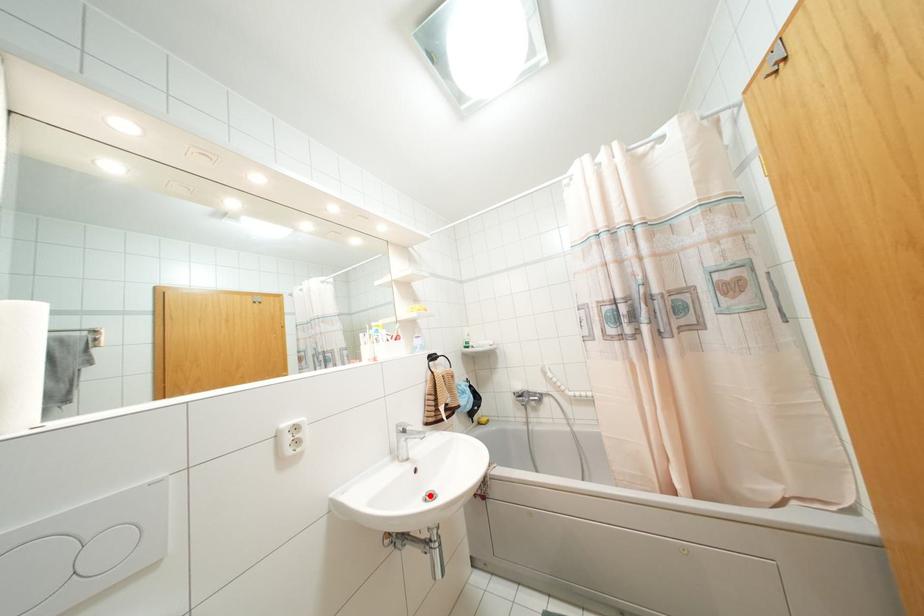
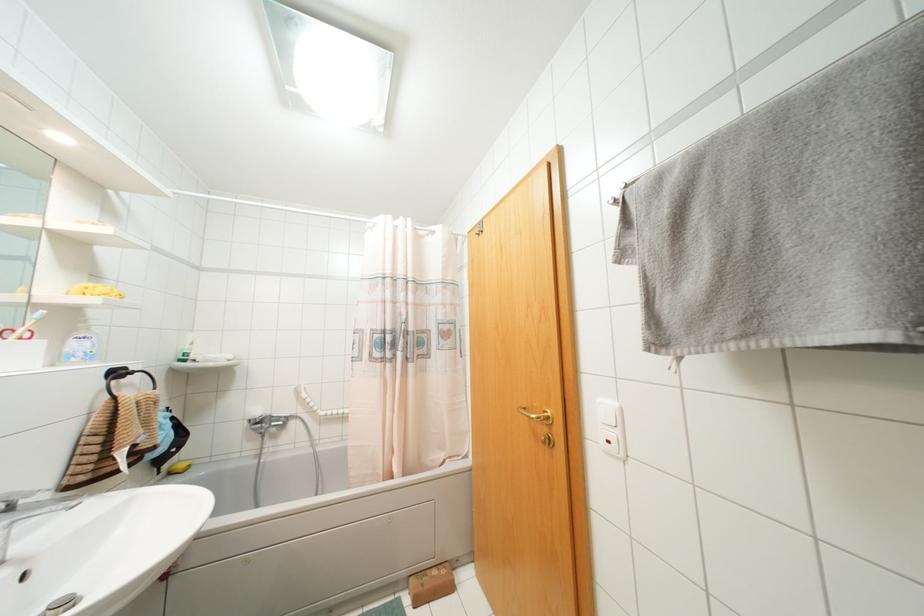
In the second image, find the point that corresponds to the highlighted location in the first image.

(66, 602)